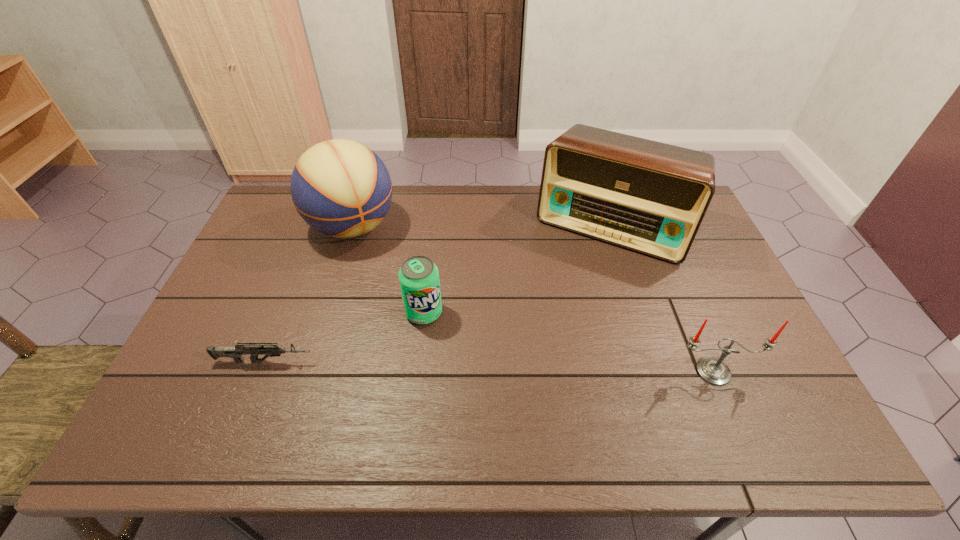
You are a GUI agent. You are given a task and a screenshot of the screen. Output one action in this format:
    pyautogui.click(x=<x>, y=<y>)
    Task: Click on the vacant spot on the desktop that is between the gun and the candle and is positioned on the patterned surface of the basketball
    The image size is (960, 540).
    Given the screenshot: What is the action you would take?
    pyautogui.click(x=449, y=365)

The width and height of the screenshot is (960, 540). Identify the location of vacant spot on the desktop that is between the gun and the candle and is positioned on the front-facing side of the radio receiver. (542, 367).

I want to click on vacant space on the desktop that is between the shortest object and the candle and is positioned on the front-facing side of the third object from right to left, so click(460, 366).